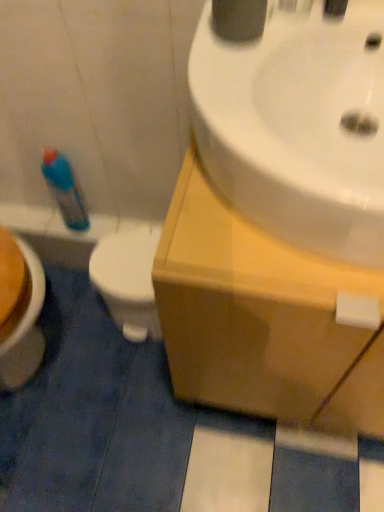
This screenshot has height=512, width=384. I want to click on blue plastic bottle at left, so click(55, 233).

What do you see at coordinates (55, 233) in the screenshot?
I see `blue plastic bottle at left` at bounding box center [55, 233].

Where is `white glossy toilet at lower left`? Image resolution: width=384 pixels, height=512 pixels. white glossy toilet at lower left is located at coordinates (128, 280).

Is point (92, 263) closer or farther from the camera than point (84, 267)?

Clearly, point (92, 263) is closer to the camera than point (84, 267).

Is white glossy toilet at lower left looking in the opposite direction of blue plastic bottle at left?

No, white glossy toilet at lower left is not facing the opposite direction of blue plastic bottle at left.

Is white glossy toilet at lower left completely or partially outside of blue plastic bottle at left?

Absolutely, white glossy toilet at lower left is external to blue plastic bottle at left.

Does blue plastic bottle at left come behind white glossy sink at upper right?

Yes, blue plastic bottle at left is further from the camera.

How far apart are blue plastic bottle at left and white glossy sink at upper right?

blue plastic bottle at left is 76.30 centimeters from white glossy sink at upper right.

Between point (24, 206) and point (211, 106), which one is positioned in front?

Positioned in front is point (211, 106).

Looking at this image, between blue plastic bottle at left and white glossy sink at upper right, which one has less height?

blue plastic bottle at left is shorter.

Consider the image. Choose the correct answer: Is blue plastic spray bottle at left inside wooden cabinet at upper right or outside it?

blue plastic spray bottle at left is not enclosed by wooden cabinet at upper right.

Is blue plastic spray bottle at left shorter than wooden cabinet at upper right?

Indeed, blue plastic spray bottle at left has a lesser height compared to wooden cabinet at upper right.

Identify the location of cleaning product below the wooden cabinet at upper right (from a real-world perspective). (64, 189).

Is blue plastic spray bottle at left facing away from wooden cabinet at upper right?

No, blue plastic spray bottle at left's orientation is not away from wooden cabinet at upper right.

Considering the sizes of objects white glossy sink at upper right and blue plastic bottle at left in the image provided, who is bigger, white glossy sink at upper right or blue plastic bottle at left?

Bigger between the two is white glossy sink at upper right.

Considering the sizes of objects white glossy sink at upper right and blue plastic bottle at left in the image provided, who is shorter, white glossy sink at upper right or blue plastic bottle at left?

With less height is blue plastic bottle at left.

Measure the distance from white glossy sink at upper right to blue plastic bottle at left.

white glossy sink at upper right and blue plastic bottle at left are 30.04 inches apart.

Which is in front, white glossy sink at upper right or blue plastic bottle at left?

white glossy sink at upper right is closer to the camera.

In the scene shown: From the image's perspective, is wooden cabinet at upper right above or below blue plastic spray bottle at left?

wooden cabinet at upper right is below blue plastic spray bottle at left.

From a real-world perspective, is wooden cabinet at upper right on top of blue plastic spray bottle at left?

Yes, from a real-world perspective, wooden cabinet at upper right is on top of blue plastic spray bottle at left.

Would you say wooden cabinet at upper right is to the left or to the right of blue plastic spray bottle at left in the picture?

In the image, wooden cabinet at upper right appears on the right side of blue plastic spray bottle at left.

Which object is closer to the camera taking this photo, wooden cabinet at upper right or blue plastic spray bottle at left?

Positioned in front is wooden cabinet at upper right.

Which of these two, white glossy sink at upper right or wooden cabinet at upper right, stands taller?

wooden cabinet at upper right is taller.

Does white glossy sink at upper right lie behind wooden cabinet at upper right?

No, it is not.

At what (x,y) coordinates should I click in order to perform the action: click on sink above the wooden cabinet at upper right (from the image's perspective). Please return your answer as a coordinate pair (x, y). Looking at the image, I should click on (295, 119).

Is white glossy sink at upper right positioned far away from wooden cabinet at upper right?

white glossy sink at upper right is actually quite close to wooden cabinet at upper right.

Looking at their sizes, would you say wooden cabinet at upper right is wider or thinner than white glossy toilet at lower left?

In the image, wooden cabinet at upper right appears to be wider than white glossy toilet at lower left.

Considering the relative positions of wooden cabinet at upper right and white glossy toilet at lower left in the image provided, is wooden cabinet at upper right to the right of white glossy toilet at lower left from the viewer's perspective?

Yes, wooden cabinet at upper right is to the right of white glossy toilet at lower left.

Is wooden cabinet at upper right aimed at white glossy toilet at lower left?

No, wooden cabinet at upper right does not turn towards white glossy toilet at lower left.

Is wooden cabinet at upper right not close to white glossy toilet at lower left?

No.

Where is `toilet on the right side of blue plastic bottle at left`? This screenshot has height=512, width=384. toilet on the right side of blue plastic bottle at left is located at coordinates (128, 280).

Identify the location of sink above the blue plastic bottle at left (from the image's perspective). (295, 119).

From the image, which object appears to be nearer to blue plastic spray bottle at left, wooden cabinet at upper right or white glossy sink at upper right?

Among the two, wooden cabinet at upper right is located nearer to blue plastic spray bottle at left.

Based on their spatial positions, is white glossy sink at upper right or white glossy toilet at lower left further from wooden cabinet at upper right?

Based on the image, white glossy toilet at lower left appears to be further to wooden cabinet at upper right.

Estimate the real-world distances between objects in this image. Which object is further from blue plastic spray bottle at left, white glossy sink at upper right or wooden cabinet at upper right?

white glossy sink at upper right is positioned further to the anchor blue plastic spray bottle at left.

When comparing their distances from blue plastic spray bottle at left, does wooden cabinet at upper right or white glossy toilet at lower left seem further?

Based on the image, wooden cabinet at upper right appears to be further to blue plastic spray bottle at left.

Based on the photo, estimate the real-world distances between objects in this image. Which object is closer to white glossy toilet at lower left, blue plastic bottle at left or blue plastic spray bottle at left?

blue plastic bottle at left is closer to white glossy toilet at lower left.

From the image, which object appears to be farther from blue plastic bottle at left, white glossy toilet at lower left or white glossy sink at upper right?

The object further to blue plastic bottle at left is white glossy sink at upper right.

From the image, which object appears to be nearer to white glossy sink at upper right, wooden cabinet at upper right or blue plastic bottle at left?

wooden cabinet at upper right is positioned closer to the anchor white glossy sink at upper right.

From the image, which object appears to be nearer to white glossy sink at upper right, wooden cabinet at upper right or white glossy toilet at lower left?

wooden cabinet at upper right.

At what (x,y) coordinates should I click in order to perform the action: click on bath between blue plastic spray bottle at left and white glossy toilet at lower left vertically. Please return your answer as a coordinate pair (x, y). The width and height of the screenshot is (384, 512). Looking at the image, I should click on (55, 233).

Identify the location of counter top between white glossy sink at upper right and blue plastic spray bottle at left from front to back. The width and height of the screenshot is (384, 512). (263, 319).

This screenshot has height=512, width=384. In order to click on counter top between white glossy sink at upper right and white glossy toilet at lower left from front to back in this screenshot , I will do `click(263, 319)`.

At what (x,y) coordinates should I click in order to perform the action: click on toilet located between white glossy sink at upper right and blue plastic bottle at left in the depth direction. Please return your answer as a coordinate pair (x, y). This screenshot has width=384, height=512. Looking at the image, I should click on (128, 280).